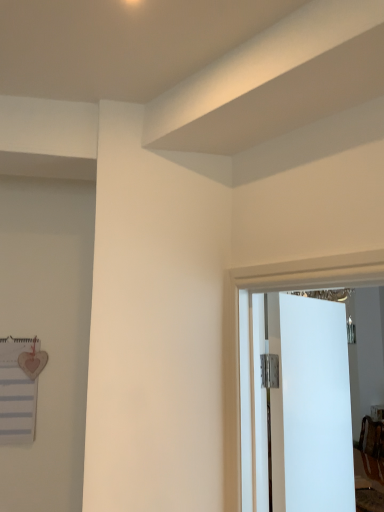
Describe the element at coordinates (298, 394) in the screenshot. The height and width of the screenshot is (512, 384). I see `white glossy door at center` at that location.

Image resolution: width=384 pixels, height=512 pixels. Identify the location of white glossy door at center. (298, 394).

What are the coordinates of `white paperboard at left` in the screenshot? It's located at (17, 392).

In order to face white paperboard at left, should I rotate leftwards or rightwards?

Turn left approximately 23.411 degrees to face it.

This screenshot has height=512, width=384. What do you see at coordinates (17, 392) in the screenshot?
I see `white paperboard at left` at bounding box center [17, 392].

What are the coordinates of `white glossy door at center` in the screenshot? It's located at (298, 394).

Is white glossy door at center to the left or to the right of white paperboard at left in the image?

white glossy door at center is positioned on white paperboard at left's right side.

Is white glossy door at center positioned behind white paperboard at left?

No, white glossy door at center is closer to the camera.

Considering the positions of point (296, 466) and point (35, 416), is point (296, 466) closer or farther from the camera than point (35, 416)?

Point (296, 466) appears to be closer to the viewer than point (35, 416).

From the image's perspective, which is above, white glossy door at center or white paperboard at left?

white paperboard at left.

From a real-world perspective, between white glossy door at center and white paperboard at left, who is vertically higher?

white paperboard at left is physically above.

Is white glossy door at center wider than white paperboard at left?

Indeed, white glossy door at center has a greater width compared to white paperboard at left.

Is white glossy door at center taller than white paperboard at left?

Indeed, white glossy door at center has a greater height compared to white paperboard at left.

Considering the relative sizes of white glossy door at center and white paperboard at left in the image provided, is white glossy door at center smaller than white paperboard at left?

No.

Is white glossy door at center located outside white paperboard at left?

Yes, white glossy door at center is outside of white paperboard at left.

Is white glossy door at center in contact with white paperboard at left?

They are not placed beside each other.

Does white glossy door at center turn towards white paperboard at left?

No, white glossy door at center is not turned towards white paperboard at left.

Can you tell me how much white glossy door at center and white paperboard at left differ in facing direction?

43.5 degrees separate the facing orientations of white glossy door at center and white paperboard at left.

Find the location of a particular element. This screenshot has width=384, height=512. door that appears below the white paperboard at left (from a real-world perspective) is located at coordinates (298, 394).

Which object is positioned more to the right, white paperboard at left or white glossy door at center?

Positioned to the right is white glossy door at center.

Which is behind, white paperboard at left or white glossy door at center?

Positioned behind is white paperboard at left.

Which point is more distant from viewer, (17,428) or (305,455)?

The point (17,428) is farther from the camera.

From the image's perspective, is white paperboard at left located above or below white glossy door at center?

Based on their image positions, white paperboard at left is located above white glossy door at center.

From a real-world perspective, does white paperboard at left sit lower than white glossy door at center?

No, from a real-world perspective, white paperboard at left is not below white glossy door at center.

Considering the sizes of white paperboard at left and white glossy door at center in the image, is white paperboard at left wider or thinner than white glossy door at center?

Considering their sizes, white paperboard at left looks slimmer than white glossy door at center.

From the picture: Is white paperboard at left shorter than white glossy door at center?

Yes, white paperboard at left is shorter than white glossy door at center.

Is white paperboard at left bigger than white glossy door at center?

Actually, white paperboard at left might be smaller than white glossy door at center.

Is white glossy door at center located within white paperboard at left?

Definitely not — white glossy door at center is not inside white paperboard at left.

Are white paperboard at left and white glossy door at center making contact?

No, white paperboard at left is not beside white glossy door at center.

Is white paperboard at left looking in the opposite direction of white glossy door at center?

white paperboard at left is not turned away from white glossy door at center.

How much distance is there between white paperboard at left and white glossy door at center?

white paperboard at left is 38.31 inches from white glossy door at center.

The image size is (384, 512). Find the location of `bulletin board on the left of the white glossy door at center`. bulletin board on the left of the white glossy door at center is located at coordinates (17, 392).

At what (x,y) coordinates should I click in order to perform the action: click on door below the white paperboard at left (from a real-world perspective). Please return your answer as a coordinate pair (x, y). This screenshot has width=384, height=512. Looking at the image, I should click on (298, 394).

You are a GUI agent. You are given a task and a screenshot of the screen. Output one action in this format:
    pyautogui.click(x=<x>, y=<y>)
    Task: Click on the door that appears in front of the white paperboard at left
    The width and height of the screenshot is (384, 512).
    Given the screenshot: What is the action you would take?
    pyautogui.click(x=298, y=394)